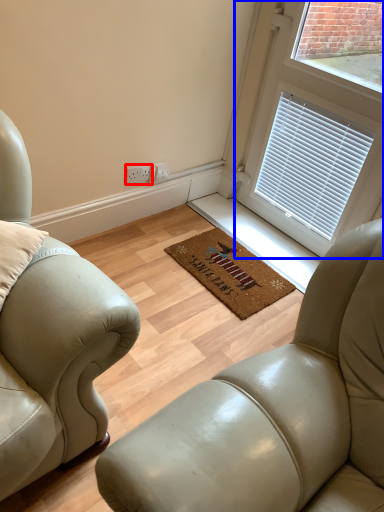
Question: Which object is closer to the camera taking this photo, electric outlet (highlighted by a red box) or window (highlighted by a blue box)?

Choices:
 (A) electric outlet
 (B) window

Answer: (B)